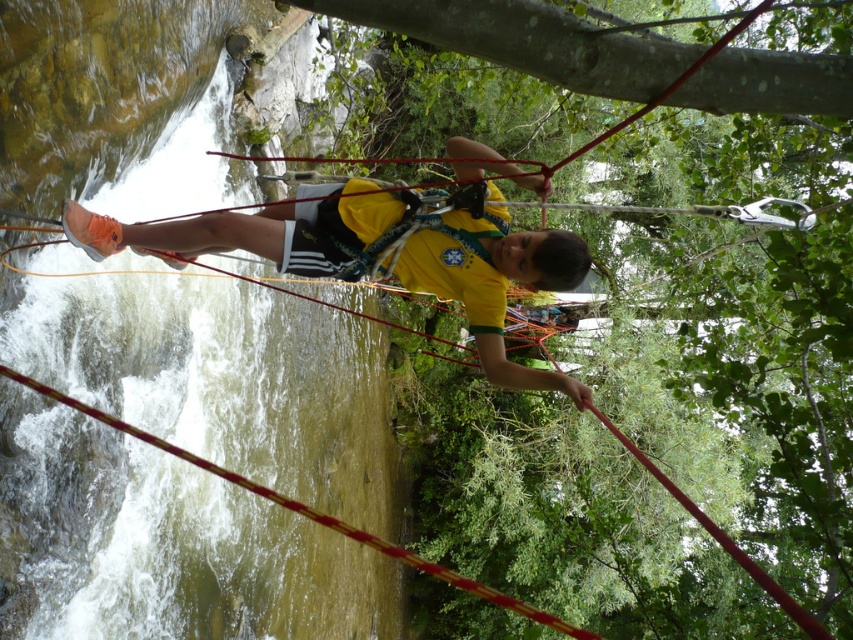
Question: Can you confirm if yellow matte shirt at center is positioned above yellow fabric safety vest at center?

Choices:
 (A) yes
 (B) no

Answer: (B)

Question: Among these points, which one is nearest to the camera?

Choices:
 (A) (532, 609)
 (B) (434, 257)

Answer: (B)

Question: Does yellow fabric safety vest at center appear over red nylon rope at center?

Choices:
 (A) no
 (B) yes

Answer: (B)

Question: Among these points, which one is farthest from the camera?

Choices:
 (A) (262, 486)
 (B) (384, 200)
 (C) (469, 301)

Answer: (A)

Question: Which object is the farthest from the yellow fabric safety vest at center?

Choices:
 (A) red nylon rope at center
 (B) yellow matte shirt at center

Answer: (A)

Question: Can you confirm if yellow matte shirt at center is positioned below red nylon rope at center?

Choices:
 (A) no
 (B) yes

Answer: (A)